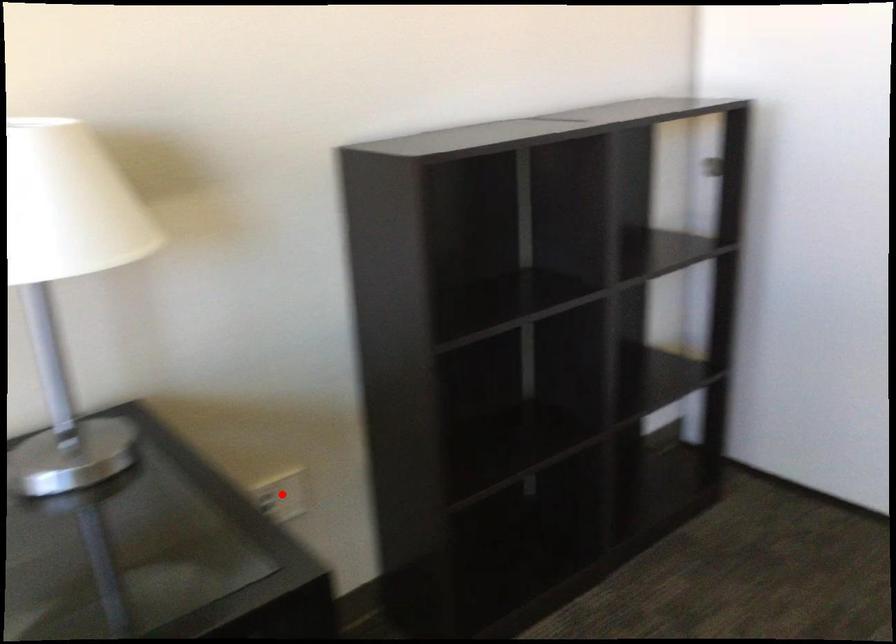
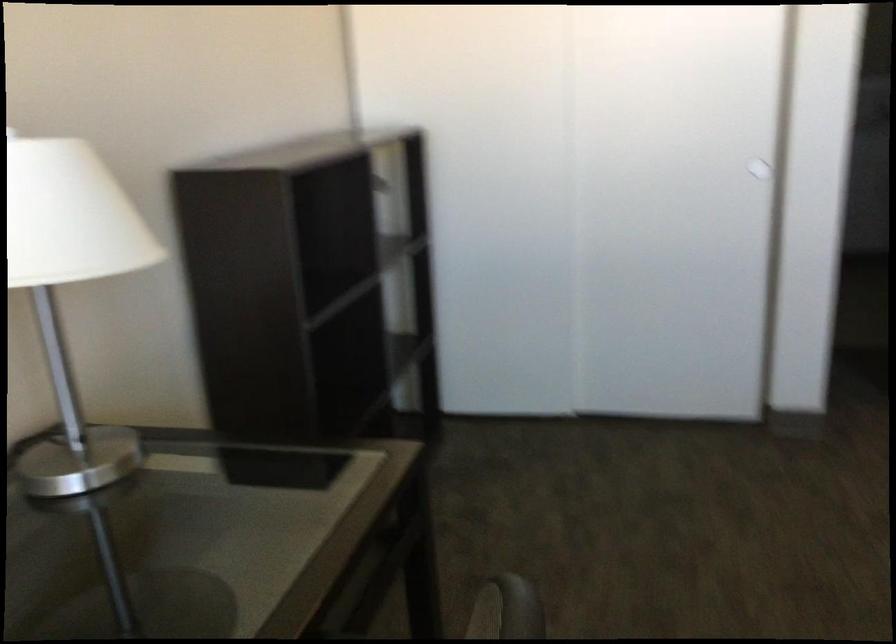
Question: I am providing you with two images of the same scene from different viewpoints. A red point is marked on the first image. Is the red point's position out of view in image 2?

Choices:
 (A) Yes
 (B) No

Answer: (A)